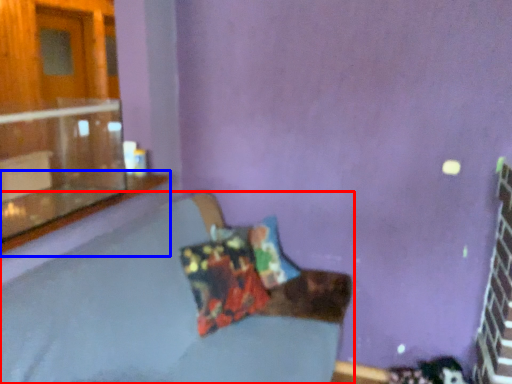
Question: Which of the following is the farthest to the observer, studio couch (highlighted by a red box) or window sill (highlighted by a blue box)?

Choices:
 (A) studio couch
 (B) window sill

Answer: (B)